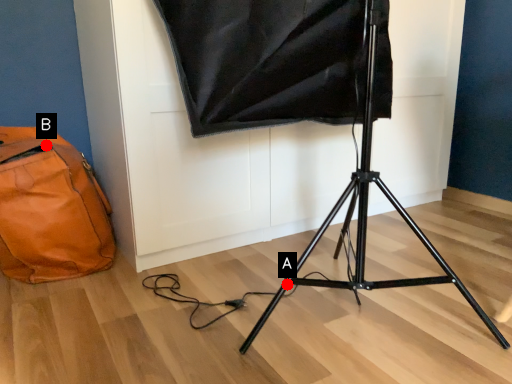
Question: Two points are circled on the image, labeled by A and B beside each circle. Which point appears closest to the camera in this image?

Choices:
 (A) A is closer
 (B) B is closer

Answer: (A)